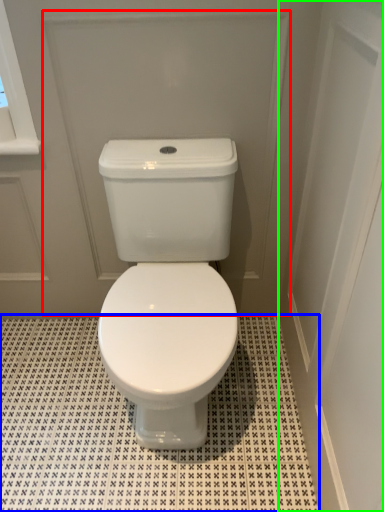
Question: Considering the real-world distances, which object is closest to screen door (highlighted by a red box)? tile (highlighted by a blue box) or screen door (highlighted by a green box).

Choices:
 (A) tile
 (B) screen door

Answer: (B)